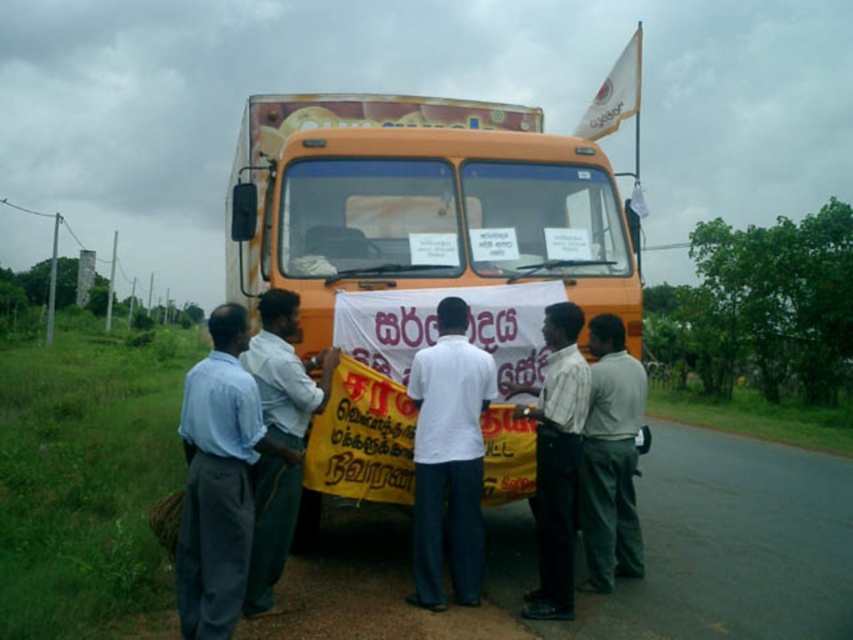
Question: Which point appears closest to the camera in this image?

Choices:
 (A) coord(285,353)
 (B) coord(593,515)
 (C) coord(207,474)
 (D) coord(418,364)

Answer: (C)

Question: Which of the following is the farthest from the observer?

Choices:
 (A) white shirt at center
 (B) light blue shirt at center
 (C) orange matte truck at center

Answer: (C)

Question: Does dark gray pants at right have a smaller size compared to white shirt at center?

Choices:
 (A) no
 (B) yes

Answer: (A)

Question: Which point appears closest to the camera in this image?

Choices:
 (A) (305, 116)
 (B) (242, 458)
 (C) (535, 440)
 (D) (264, 348)

Answer: (B)

Question: Does light blue shirt at center come behind dark gray pants at right?

Choices:
 (A) yes
 (B) no

Answer: (B)

Question: Observing the image, what is the correct spatial positioning of white matte shirt at center in reference to dark gray pants at right?

Choices:
 (A) left
 (B) right

Answer: (A)